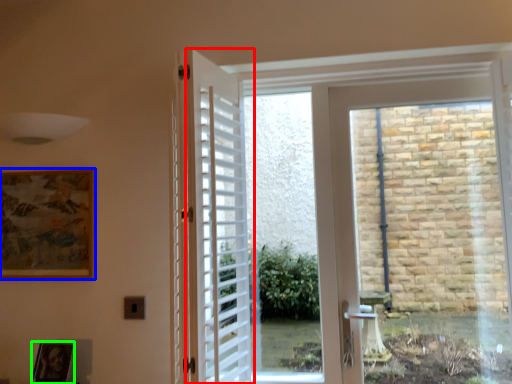
Question: Which object is positioned closest to door (highlighted by a red box)? Select from picture frame (highlighted by a blue box) and picture frame (highlighted by a green box).

Choices:
 (A) picture frame
 (B) picture frame

Answer: (A)